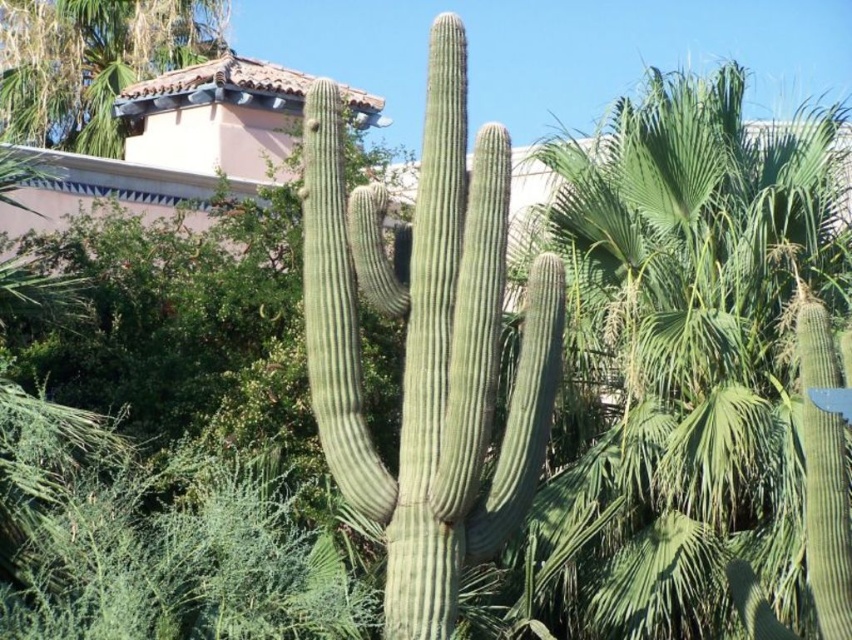
You are standing at the center of the desert scene. There is a point marked at coordinates (707, 360). What object is located at that exact point?

The point at (707, 360) is where the green leafy palm tree at center is located.

You are standing at the center of the desert scene. There is a green leafy palm tree at center. Where is the green leafy palm tree located in relation to your position?

The green leafy palm tree at center is located at point (707, 360), which means it is positioned slightly to the right and above your current position at the center.

You are a hiker who wants to take a photo of the green leafy palm tree at center and the green matte cactus at upper left. Which object should you focus on first if you want both to be in the frame without moving the camera?

The green leafy palm tree at center is positioned under the green matte cactus at upper left, so focusing on the palm tree first would ensure both are in the frame since the cactus is above it.